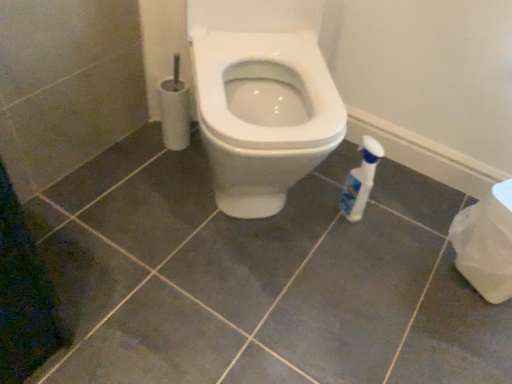
This screenshot has height=384, width=512. Find the location of `vacant position to the left of white plastic spray bottle at lower right`. vacant position to the left of white plastic spray bottle at lower right is located at coordinates (305, 213).